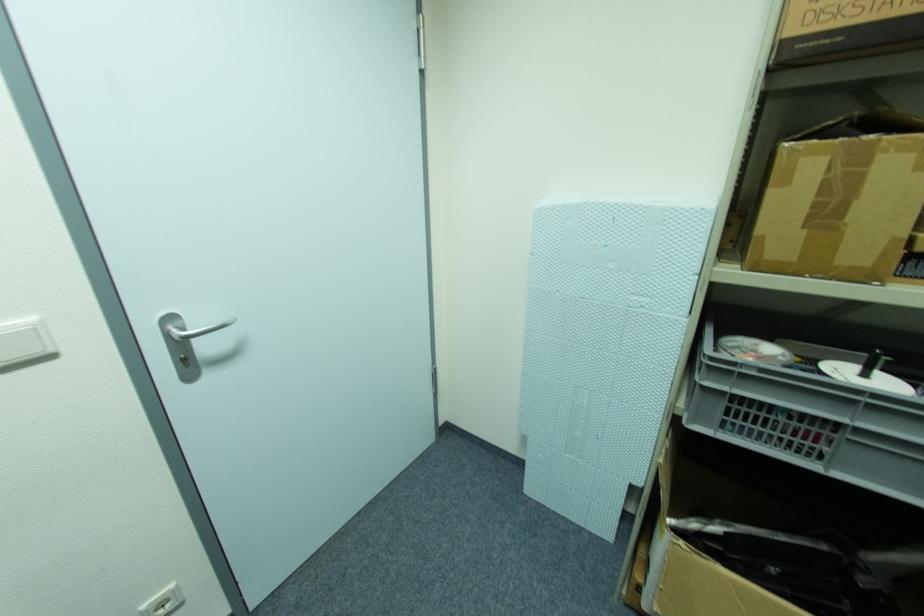
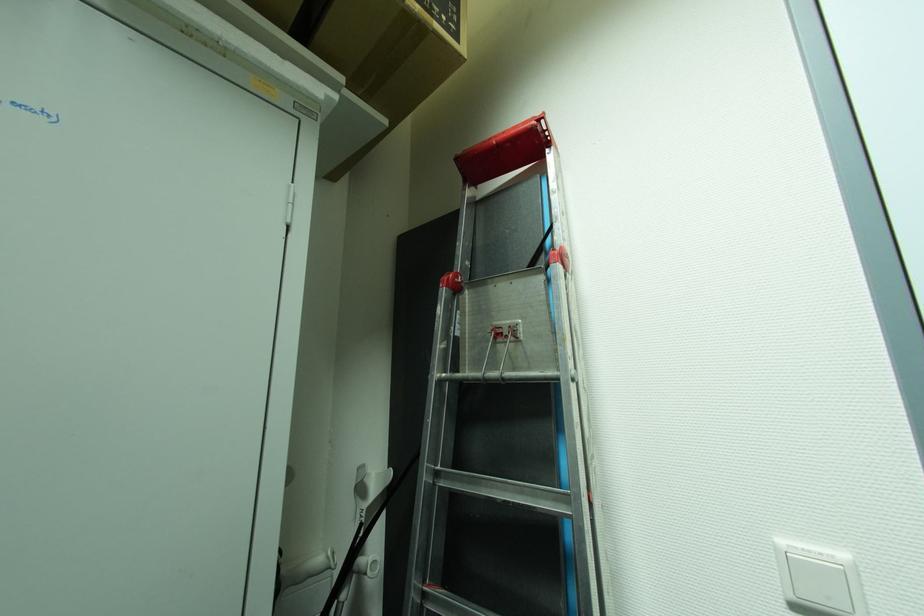
Question: The camera is either moving clockwise (left) or counter-clockwise (right) around the object. The first image is from the beginning of the video and the second image is from the end. Is the camera moving left or right when shooting the video?

Choices:
 (A) Left
 (B) Right

Answer: (B)